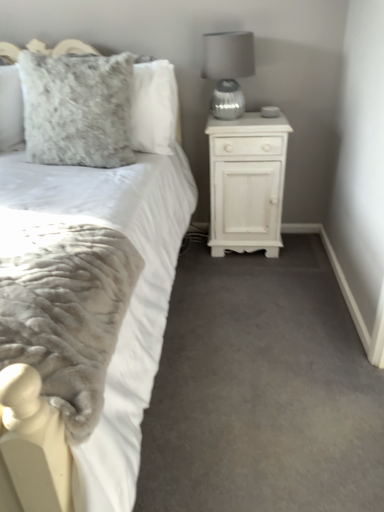
Identify the location of vacant space to the right of white wood nightstand at right. This screenshot has width=384, height=512. (300, 252).